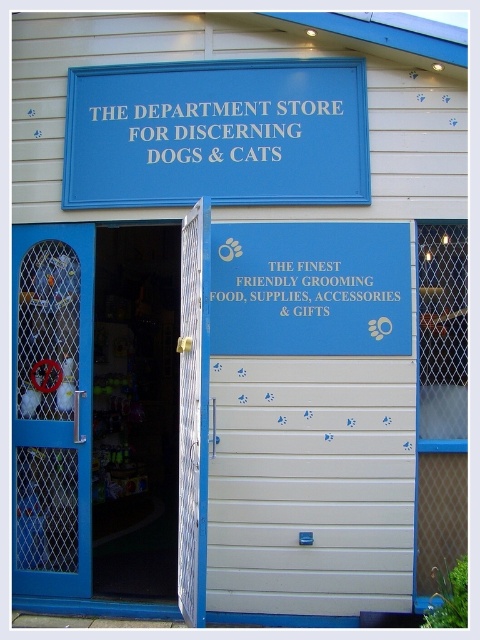
You are standing in front of the store and want to enter through the blue metal door at left. If your wheelchair has a turning radius of 12 feet, can you maneuver into the entrance area without obstacles?

The distance between the blue metal door at left and the camera is 15.11 feet. Since your wheelchair requires a turning radius of 12 feet, you have enough space to maneuver into the entrance area without obstacles.

Consider the image. You are a customer entering the store and see the white mesh door at center and the blue plastic sign at center. Which object is closer to the ground?

The white mesh door at center is closer to the ground because it is located below the blue plastic sign at center.